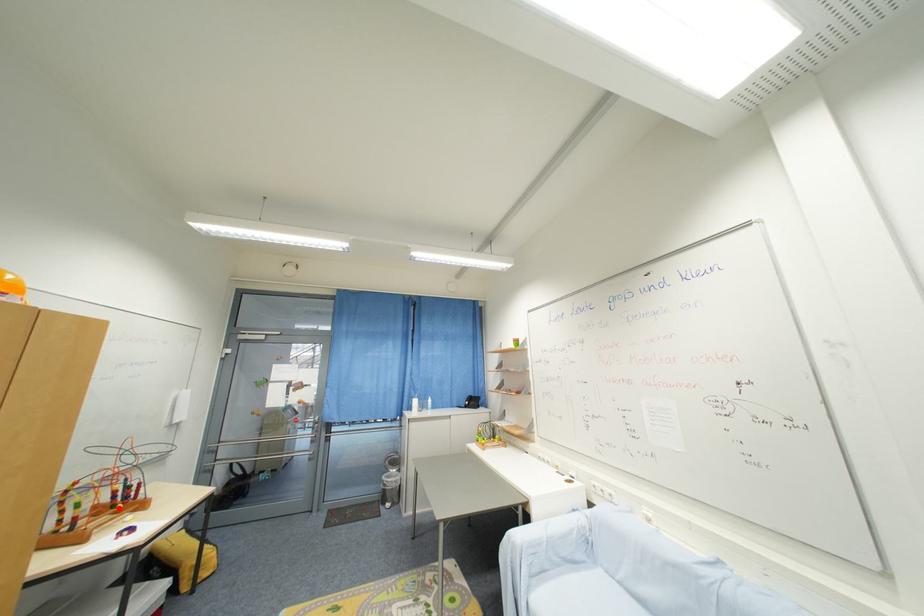
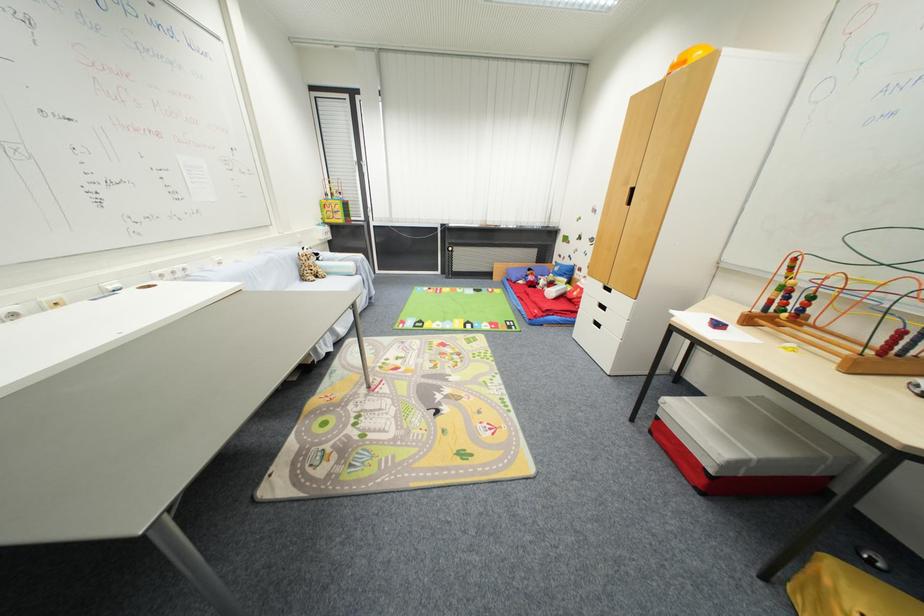
Locate, in the second image, the point that corresponds to the highlighted location in the first image.

(789, 313)